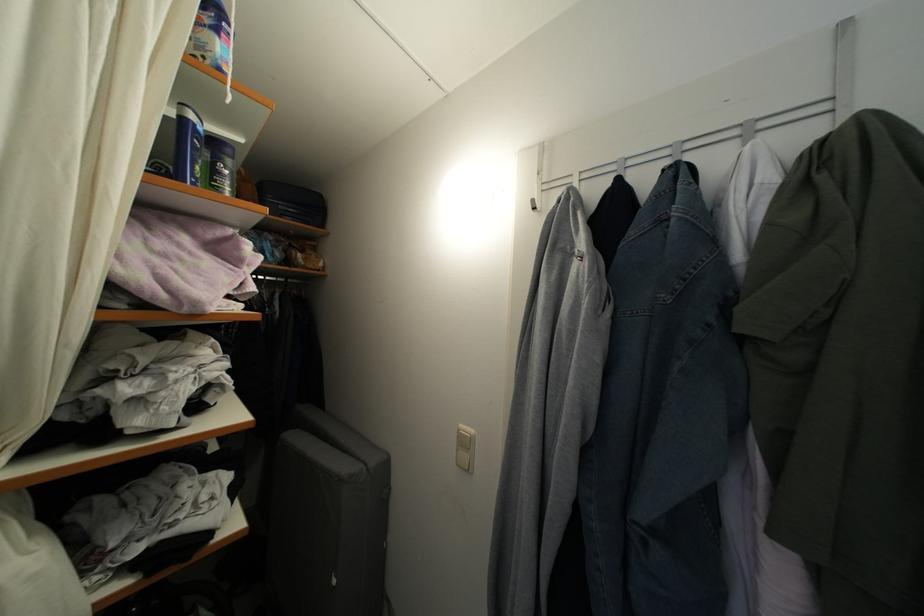
Where is `white light switch`? The image size is (924, 616). white light switch is located at coordinates (465, 448).